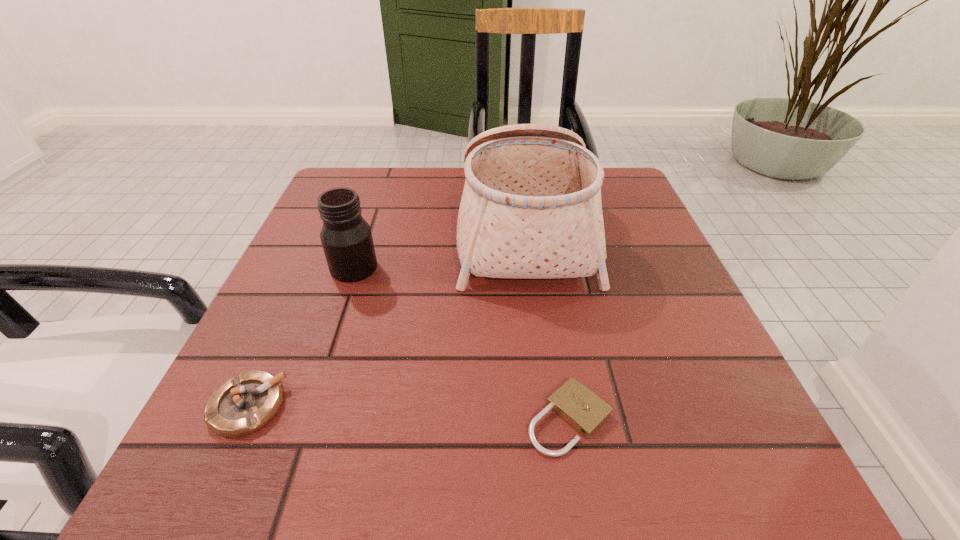
Find the location of a particular element. The image size is (960, 540). free region at the right edge of the desktop is located at coordinates (702, 396).

At what (x,y) coordinates should I click in order to perform the action: click on vacant space at the far left corner. Please return your answer as a coordinate pair (x, y). This screenshot has width=960, height=540. Looking at the image, I should click on (347, 187).

Find the location of a particular element. free space at the near left corner is located at coordinates (296, 448).

You are a GUI agent. You are given a task and a screenshot of the screen. Output one action in this format:
    pyautogui.click(x=<x>, y=<y>)
    Task: Click on the blank space at the near right corner
    Image resolution: width=960 pixels, height=540 pixels.
    Given the screenshot: What is the action you would take?
    pyautogui.click(x=730, y=458)

The image size is (960, 540). Identify the location of free space between the ashtray and the tallest object. (386, 318).

The image size is (960, 540). I want to click on vacant point located between the padlock and the ashtray, so click(x=408, y=412).

Image resolution: width=960 pixels, height=540 pixels. In order to click on empty location between the ashtray and the shortest object in this screenshot , I will do `click(408, 412)`.

Where is `vacant space that's between the tallest object and the jar`? vacant space that's between the tallest object and the jar is located at coordinates (440, 249).

Locate an element on the screen. empty location between the tallest object and the third tallest object is located at coordinates (386, 318).

The image size is (960, 540). Find the location of `vacant point located between the tallest object and the padlock`. vacant point located between the tallest object and the padlock is located at coordinates (547, 325).